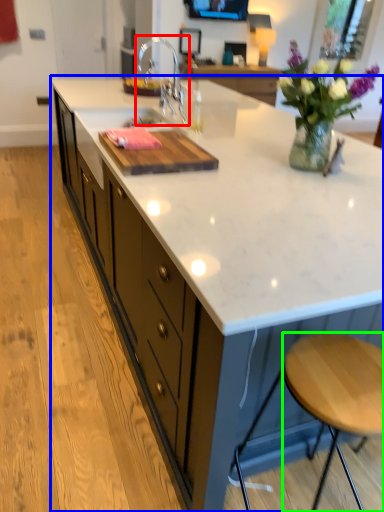
Question: Estimate the real-world distances between objects in this image. Which object is farther from tap (highlighted by a red box), countertop (highlighted by a blue box) or stool (highlighted by a green box)?

Choices:
 (A) countertop
 (B) stool

Answer: (B)